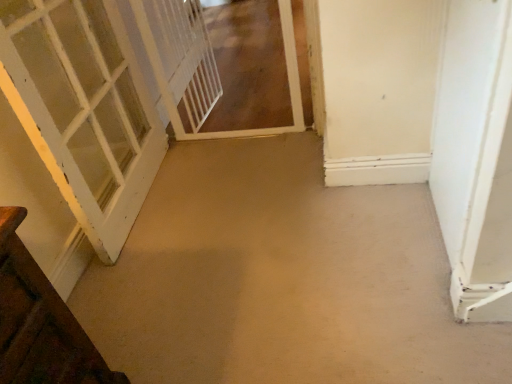
Describe the element at coordinates (476, 157) in the screenshot. This screenshot has height=384, width=512. I see `white matte door at right, which is counted as the 3th door, starting from the left` at that location.

What do you see at coordinates (182, 63) in the screenshot? I see `white mesh screen door at center, which is the second screen door from right to left` at bounding box center [182, 63].

Image resolution: width=512 pixels, height=384 pixels. I want to click on white matte door at right, which is counted as the 3th door, starting from the left, so click(476, 157).

You are a GUI agent. You are given a task and a screenshot of the screen. Output one action in this format:
    pyautogui.click(x=<x>, y=<y>)
    Task: Click on the concrete located behind the white matte door at right, the 1th door when ordered from right to left
    The image size is (512, 384).
    Given the screenshot: What is the action you would take?
    pyautogui.click(x=282, y=278)

From the image's perspective, is beige carpet at center above white matte door at right, which is counted as the 3th door, starting from the left?

No, from the image's perspective, beige carpet at center is not over white matte door at right, which is counted as the 3th door, starting from the left.

Which is more distant, (270, 312) or (484, 275)?

The point (270, 312) is farther from the camera.

Consider the image. Is beige carpet at center inside the boundaries of white matte door at right, the 1th door when ordered from right to left, or outside?

beige carpet at center is not enclosed by white matte door at right, the 1th door when ordered from right to left.

Is the depth of white matte door at right, the 1th door when ordered from right to left, less than that of white mesh screen door at upper left, acting as the second screen door starting from the left?

Yes, white matte door at right, the 1th door when ordered from right to left, is closer to the viewer.

From a real-world perspective, is white matte door at right, which is counted as the 3th door, starting from the left, positioned over white mesh screen door at upper left, acting as the second screen door starting from the left, based on gravity?

Yes, from a real-world perspective, white matte door at right, which is counted as the 3th door, starting from the left, is over white mesh screen door at upper left, acting as the second screen door starting from the left

Is white matte door at right, which is counted as the 3th door, starting from the left, wider or thinner than white mesh screen door at upper left, acting as the second screen door starting from the left?

In the image, white matte door at right, which is counted as the 3th door, starting from the left, appears to be more narrow than white mesh screen door at upper left, acting as the second screen door starting from the left.

From the image's perspective, between white matte door at right, which is counted as the 3th door, starting from the left, and white mesh screen door at upper left, acting as the second screen door starting from the left, which one is located above?

white mesh screen door at upper left, acting as the second screen door starting from the left, appears higher in the image.

Which object is wider, beige carpet at center or white mesh screen door at center, which ranks as the 1th screen door in left-to-right order?

Wider between the two is beige carpet at center.

Between beige carpet at center and white mesh screen door at center, which ranks as the 1th screen door in left-to-right order, which one is positioned in front?

beige carpet at center is in front.

Does beige carpet at center have a larger size compared to white mesh screen door at center, which is the second screen door from right to left?

Yes.

Is beige carpet at center positioned beyond the bounds of white mesh screen door at center, which is the second screen door from right to left?

Yes, beige carpet at center is located beyond the bounds of white mesh screen door at center, which is the second screen door from right to left.

From the image's perspective, is white mesh screen door at upper left, the 1th screen door viewed from the right, located beneath beige carpet at center?

No.

Is white mesh screen door at upper left, the 1th screen door viewed from the right, facing away from beige carpet at center?

white mesh screen door at upper left, the 1th screen door viewed from the right, is not turned away from beige carpet at center.

Consider the image. From their relative heights in the image, would you say white mesh screen door at upper left, the 1th screen door viewed from the right, is taller or shorter than beige carpet at center?

white mesh screen door at upper left, the 1th screen door viewed from the right, is taller than beige carpet at center.

How different are the orientations of white mesh screen door at upper left, acting as the second screen door starting from the left, and beige carpet at center in degrees?

The angular difference between white mesh screen door at upper left, acting as the second screen door starting from the left, and beige carpet at center is 91.8 degrees.

From a real-world perspective, is white mesh screen door at center, which ranks as the 1th screen door in left-to-right order, located beneath wooden door at lower left, acting as the 2th door starting from the right?

No, from a real-world perspective, white mesh screen door at center, which ranks as the 1th screen door in left-to-right order, is not beneath wooden door at lower left, acting as the 2th door starting from the right.

Is wooden door at lower left, placed as the second door when sorted from left to right, a part of white mesh screen door at center, which ranks as the 1th screen door in left-to-right order?

Definitely not — wooden door at lower left, placed as the second door when sorted from left to right, is not inside white mesh screen door at center, which ranks as the 1th screen door in left-to-right order.

In terms of width, does white mesh screen door at center, which is the second screen door from right to left, look wider or thinner when compared to wooden door at lower left, acting as the 2th door starting from the right?

Considering their sizes, white mesh screen door at center, which is the second screen door from right to left, looks slimmer than wooden door at lower left, acting as the 2th door starting from the right.

From the image's perspective, between white mesh screen door at center, which is the second screen door from right to left, and wooden door at lower left, placed as the second door when sorted from left to right, which one is located above?

white mesh screen door at center, which is the second screen door from right to left.

From the image's perspective, which is above, white painted wood door at left, marked as the first door in a left-to-right arrangement, or white mesh screen door at center, which is the second screen door from right to left?

From the image's view, white mesh screen door at center, which is the second screen door from right to left, is above.

Does white painted wood door at left, marked as the first door in a left-to-right arrangement, have a greater height compared to white mesh screen door at center, which is the second screen door from right to left?

Yes, white painted wood door at left, marked as the first door in a left-to-right arrangement, is taller than white mesh screen door at center, which is the second screen door from right to left.

Would you say white painted wood door at left, which is the third door in right-to-left order, is to the left or to the right of white mesh screen door at center, which is the second screen door from right to left, in the picture?

white painted wood door at left, which is the third door in right-to-left order, is to the left of white mesh screen door at center, which is the second screen door from right to left.

Would you say white painted wood door at left, which is the third door in right-to-left order, is inside or outside white mesh screen door at center, which ranks as the 1th screen door in left-to-right order?

white painted wood door at left, which is the third door in right-to-left order, lies outside white mesh screen door at center, which ranks as the 1th screen door in left-to-right order.

Does wooden door at lower left, acting as the 2th door starting from the right, have a greater height compared to white painted wood door at left, which is the third door in right-to-left order?

In fact, wooden door at lower left, acting as the 2th door starting from the right, may be shorter than white painted wood door at left, which is the third door in right-to-left order.

Is white painted wood door at left, marked as the first door in a left-to-right arrangement, surrounded by wooden door at lower left, acting as the 2th door starting from the right?

No, white painted wood door at left, marked as the first door in a left-to-right arrangement, is not inside wooden door at lower left, acting as the 2th door starting from the right.

Considering the positions of objects wooden door at lower left, acting as the 2th door starting from the right, and white painted wood door at left, which is the third door in right-to-left order, in the image provided, who is more to the right, wooden door at lower left, acting as the 2th door starting from the right, or white painted wood door at left, which is the third door in right-to-left order,?

Positioned to the right is wooden door at lower left, acting as the 2th door starting from the right.

The image size is (512, 384). There is a beige carpet at center. What are the coordinates of `the 2nd door above it (from a real-world perspective)` in the screenshot? It's located at (476, 157).

Identify the location of door that is the 2nd one when counting forward from the white mesh screen door at upper left, acting as the second screen door starting from the left. This screenshot has width=512, height=384. (x=476, y=157).

Estimate the real-world distances between objects in this image. Which object is closer to white mesh screen door at center, which ranks as the 1th screen door in left-to-right order, beige carpet at center or white mesh screen door at upper left, acting as the second screen door starting from the left?

white mesh screen door at upper left, acting as the second screen door starting from the left, is closer to white mesh screen door at center, which ranks as the 1th screen door in left-to-right order.

Estimate the real-world distances between objects in this image. Which object is further from wooden door at lower left, placed as the second door when sorted from left to right, white mesh screen door at center, which is the second screen door from right to left, or white mesh screen door at upper left, acting as the second screen door starting from the left?

Based on the image, white mesh screen door at upper left, acting as the second screen door starting from the left, appears to be further to wooden door at lower left, placed as the second door when sorted from left to right.

Looking at this image, from the image, which object appears to be nearer to white matte door at right, which is counted as the 3th door, starting from the left, white mesh screen door at center, which is the second screen door from right to left, or wooden door at lower left, acting as the 2th door starting from the right?

Among the two, wooden door at lower left, acting as the 2th door starting from the right, is located nearer to white matte door at right, which is counted as the 3th door, starting from the left.

Consider the image. Looking at the image, which one is located further to beige carpet at center, white matte door at right, the 1th door when ordered from right to left, or white painted wood door at left, which is the third door in right-to-left order?

white painted wood door at left, which is the third door in right-to-left order.

Estimate the real-world distances between objects in this image. Which object is further from white mesh screen door at upper left, acting as the second screen door starting from the left, white matte door at right, which is counted as the 3th door, starting from the left, or white mesh screen door at center, which is the second screen door from right to left?

Among the two, white matte door at right, which is counted as the 3th door, starting from the left, is located further to white mesh screen door at upper left, acting as the second screen door starting from the left.

Looking at the image, which one is located closer to white mesh screen door at center, which is the second screen door from right to left, wooden door at lower left, placed as the second door when sorted from left to right, or beige carpet at center?

Among the two, beige carpet at center is located nearer to white mesh screen door at center, which is the second screen door from right to left.

Considering their positions, is white matte door at right, the 1th door when ordered from right to left, positioned further to white mesh screen door at upper left, the 1th screen door viewed from the right, than white painted wood door at left, which is the third door in right-to-left order?

white matte door at right, the 1th door when ordered from right to left, is further to white mesh screen door at upper left, the 1th screen door viewed from the right.

Considering their positions, is white painted wood door at left, marked as the first door in a left-to-right arrangement, positioned further to beige carpet at center than white matte door at right, the 1th door when ordered from right to left?

white painted wood door at left, marked as the first door in a left-to-right arrangement, is positioned further to the anchor beige carpet at center.

Where is `concrete between wooden door at lower left, acting as the 2th door starting from the right, and white mesh screen door at upper left, the 1th screen door viewed from the right, along the z-axis`? This screenshot has width=512, height=384. concrete between wooden door at lower left, acting as the 2th door starting from the right, and white mesh screen door at upper left, the 1th screen door viewed from the right, along the z-axis is located at coordinates (x=282, y=278).

In order to click on door situated between white painted wood door at left, marked as the first door in a left-to-right arrangement, and beige carpet at center from left to right in this screenshot , I will do `click(40, 322)`.

I want to click on door positioned between beige carpet at center and white mesh screen door at upper left, the 1th screen door viewed from the right, from near to far, so click(83, 110).

Find the location of a particular element. The image size is (512, 384). door located between white painted wood door at left, which is the third door in right-to-left order, and white matte door at right, which is counted as the 3th door, starting from the left, in the left-right direction is located at coordinates (40, 322).